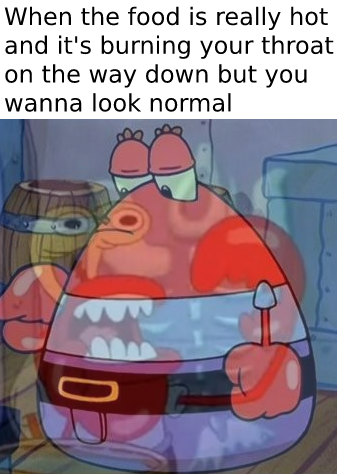
Locate an element on the screen. grayish blue wall in top left of image is located at coordinates (8, 135).